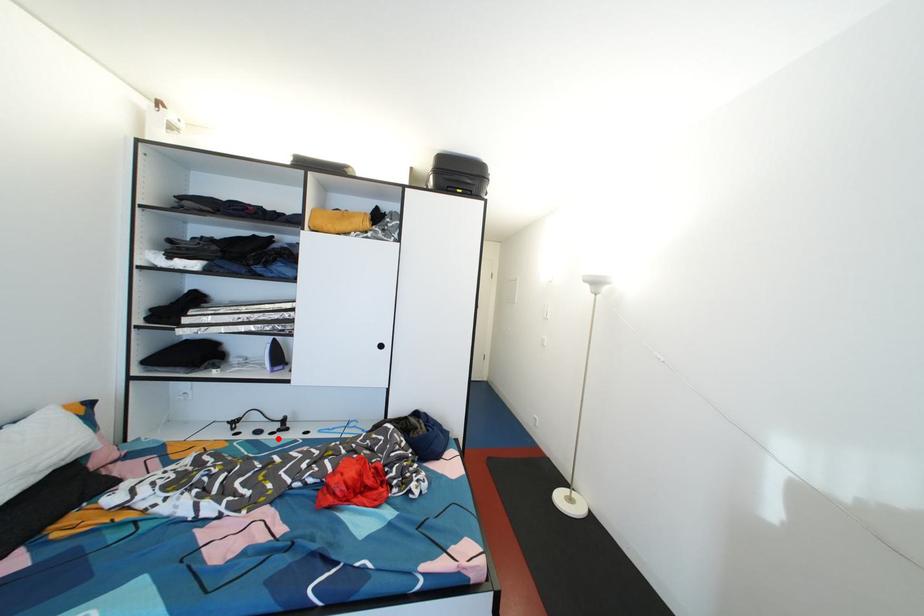
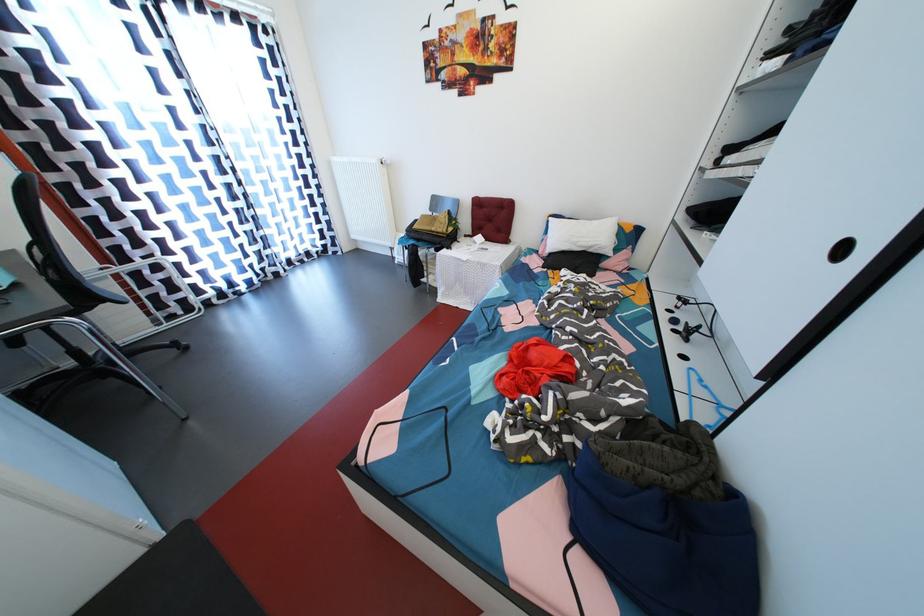
Find the pixel in the second image that matches the highlighted location in the first image.

(681, 336)